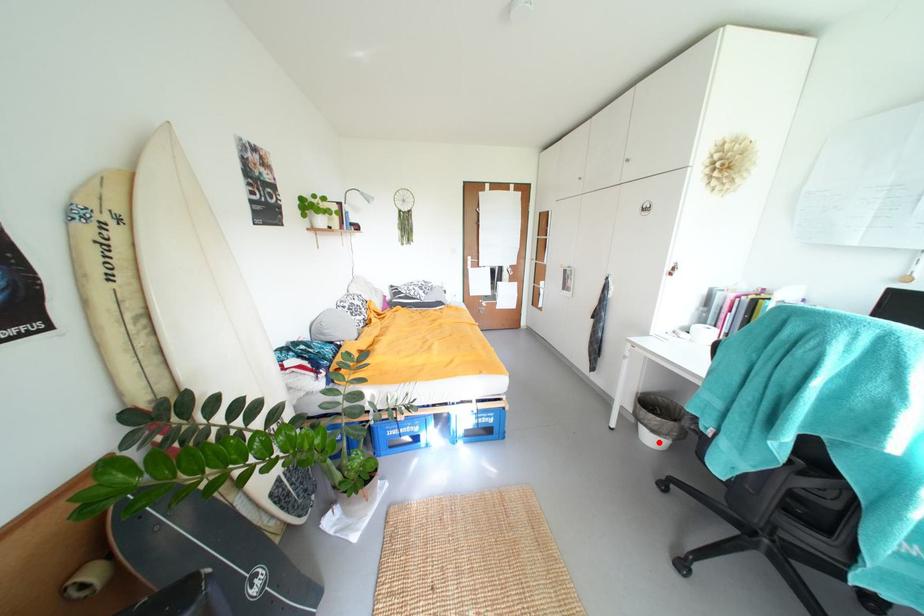
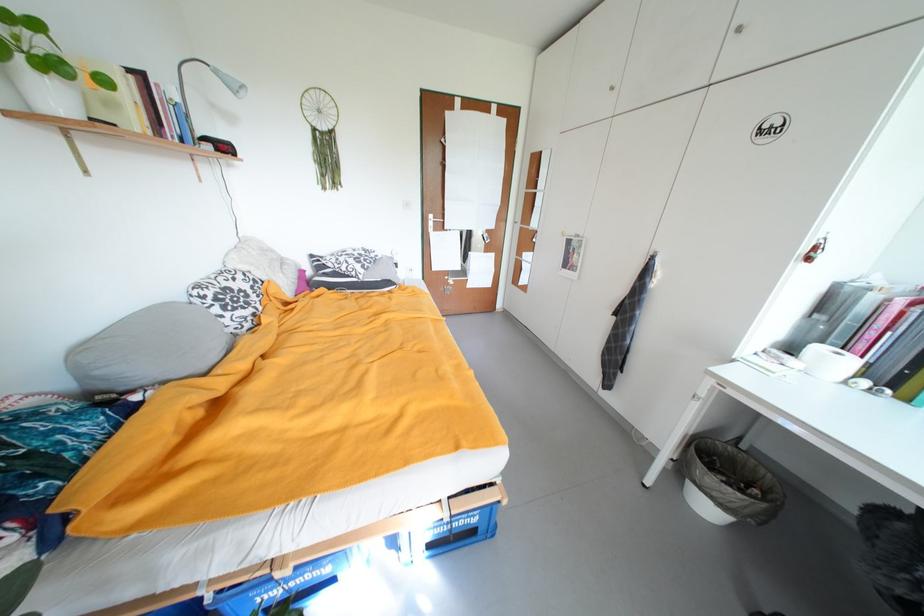
The point at the highlighted location is marked in the first image. Where is the corresponding point in the second image?

(714, 509)